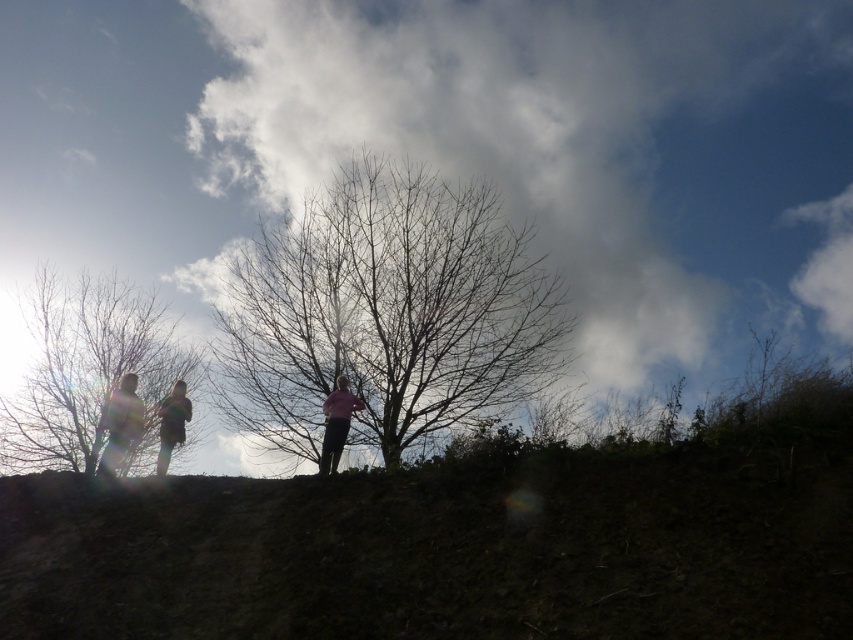
You are a hiker trying to find a spot to set up camp. You have a map showing a point at coordinates (463, 540). According to the scene, what is located at that point?

At point (463, 540) lies dull brown dirt at center.

You are a hiker planning to set up a tent in the area shown in the image. The coordinates provided indicate a specific location. Based on the scene description, what type of terrain would you encounter at point (x=463, y=540)?

The point (x=463, y=540) corresponds to dull brown dirt at center, which is suitable for setting up a tent as it is flat and stable ground.

You are an observer looking at the scene. There is a white fluffy cloud at upper center and bare branches at center. Which object is located to the right of the other?

The white fluffy cloud at upper center is positioned on the right side of bare branches at center.